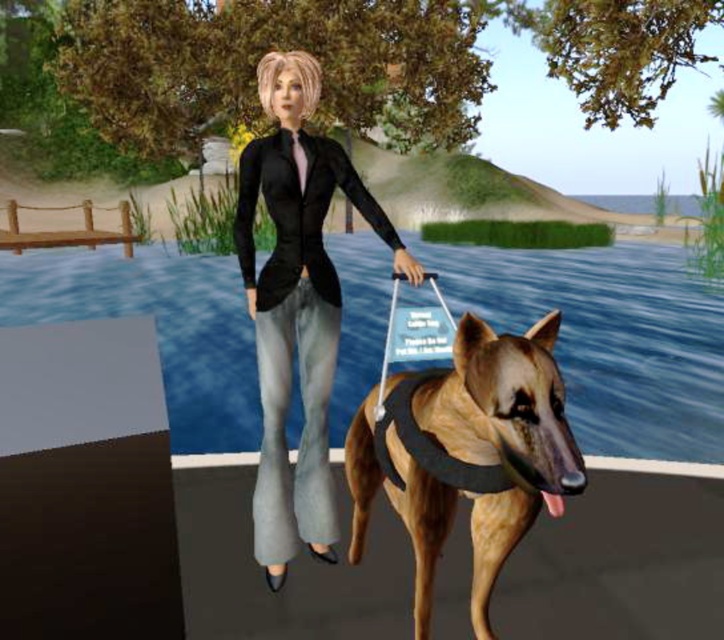
Question: Is matte black blazer at center to the left of golden-brown fur harness at center from the viewer's perspective?

Choices:
 (A) yes
 (B) no

Answer: (A)

Question: Which of the following is the farthest from the observer?

Choices:
 (A) (369, 500)
 (B) (307, 180)

Answer: (A)

Question: Is matte black blazer at center to the left of golden-brown fur harness at center from the viewer's perspective?

Choices:
 (A) no
 (B) yes

Answer: (B)

Question: Does matte black blazer at center have a greater width compared to golden-brown fur harness at center?

Choices:
 (A) yes
 (B) no

Answer: (A)